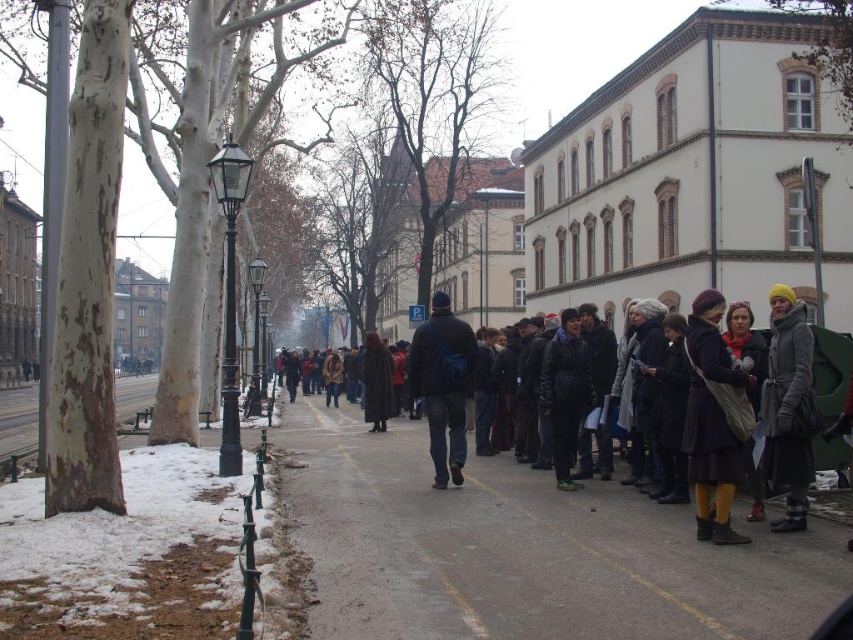
Between gray asphalt sidewalk at center and dark blue fabric jacket at center, which one has less height?

gray asphalt sidewalk at center is shorter.

Between point (654, 524) and point (450, 316), which one is positioned in front?

Point (654, 524) is in front.

This screenshot has height=640, width=853. In order to click on gray asphalt sidewalk at center in this screenshot , I will do `click(523, 550)`.

Who is taller, dark gray coat at center or yellow knit hat at right?

dark gray coat at center

Between dark gray coat at center and yellow knit hat at right, which one has less height?

yellow knit hat at right

Does point (788, 292) lie in front of point (793, 360)?

No, it is behind (793, 360).

The height and width of the screenshot is (640, 853). Identify the location of dark gray coat at center. (744, 413).

Between gray asphalt sidewalk at center and dark blue wool coat at center, which one has less height?

gray asphalt sidewalk at center is shorter.

Is gray asphalt sidewalk at center positioned at the back of dark blue wool coat at center?

No, gray asphalt sidewalk at center is in front of dark blue wool coat at center.

Does point (491, 611) come farther from viewer compared to point (711, 376)?

No.

This screenshot has width=853, height=640. In order to click on gray asphalt sidewalk at center in this screenshot , I will do `click(523, 550)`.